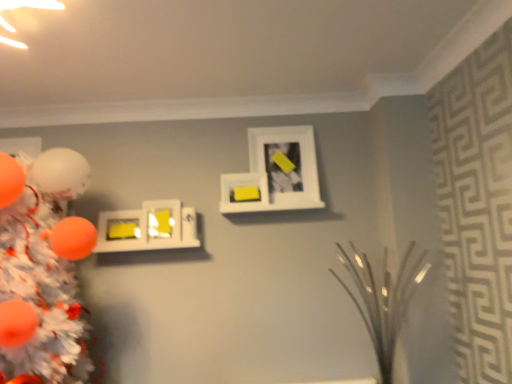
Question: Can you confirm if orange matte christmas tree at left is positioned to the left of yellow matte picture frame at upper center, the 3th picture frame positioned from the left?

Choices:
 (A) yes
 (B) no

Answer: (A)

Question: Is yellow matte picture frame at upper center, arranged as the second picture frame when viewed from the right, inside orange matte christmas tree at left?

Choices:
 (A) yes
 (B) no

Answer: (B)

Question: Is orange matte christmas tree at left bigger than yellow matte picture frame at upper center, the 3th picture frame positioned from the left?

Choices:
 (A) yes
 (B) no

Answer: (A)

Question: Does orange matte christmas tree at left touch yellow matte picture frame at upper center, the 3th picture frame positioned from the left?

Choices:
 (A) yes
 (B) no

Answer: (B)

Question: Is orange matte christmas tree at left positioned behind yellow matte picture frame at upper center, the 3th picture frame positioned from the left?

Choices:
 (A) no
 (B) yes

Answer: (A)

Question: Is orange matte christmas tree at left aimed at yellow matte picture frame at upper center, arranged as the second picture frame when viewed from the right?

Choices:
 (A) yes
 (B) no

Answer: (B)

Question: Does yellow matte picture frame at center left, which is counted as the 4th picture frame, starting from the right, have a greater height compared to yellow matte picture frame at upper center, the 3th picture frame positioned from the left?

Choices:
 (A) no
 (B) yes

Answer: (A)

Question: From the image's perspective, is yellow matte picture frame at center left, which is counted as the 4th picture frame, starting from the right, on top of yellow matte picture frame at upper center, the 3th picture frame positioned from the left?

Choices:
 (A) no
 (B) yes

Answer: (A)

Question: Is yellow matte picture frame at center left, which is counted as the 4th picture frame, starting from the right, positioned in front of yellow matte picture frame at upper center, the 3th picture frame positioned from the left?

Choices:
 (A) no
 (B) yes

Answer: (B)

Question: Is yellow matte picture frame at center left, placed as the first picture frame when sorted from left to right, turned away from yellow matte picture frame at upper center, the 3th picture frame positioned from the left?

Choices:
 (A) yes
 (B) no

Answer: (B)

Question: From a real-world perspective, is yellow matte picture frame at center left, which is counted as the 4th picture frame, starting from the right, on top of yellow matte picture frame at upper center, the 3th picture frame positioned from the left?

Choices:
 (A) no
 (B) yes

Answer: (A)

Question: Could you tell me if yellow matte picture frame at center left, which is counted as the 4th picture frame, starting from the right, is turned towards yellow matte picture frame at upper center, arranged as the second picture frame when viewed from the right?

Choices:
 (A) no
 (B) yes

Answer: (A)

Question: Does orange matte christmas tree at left appear on the right side of matte yellow picture frame at center-left, arranged as the 2th picture frame when viewed from the left?

Choices:
 (A) yes
 (B) no

Answer: (B)